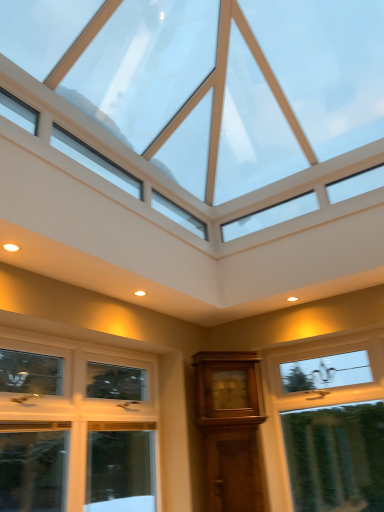
Identify the location of transparent glass skylight at upper center. Image resolution: width=384 pixels, height=512 pixels. (227, 87).

What do you see at coordinates (227, 87) in the screenshot?
I see `transparent glass skylight at upper center` at bounding box center [227, 87].

Find the location of a particular element. This screenshot has height=512, width=384. transparent glass skylight at upper center is located at coordinates (227, 87).